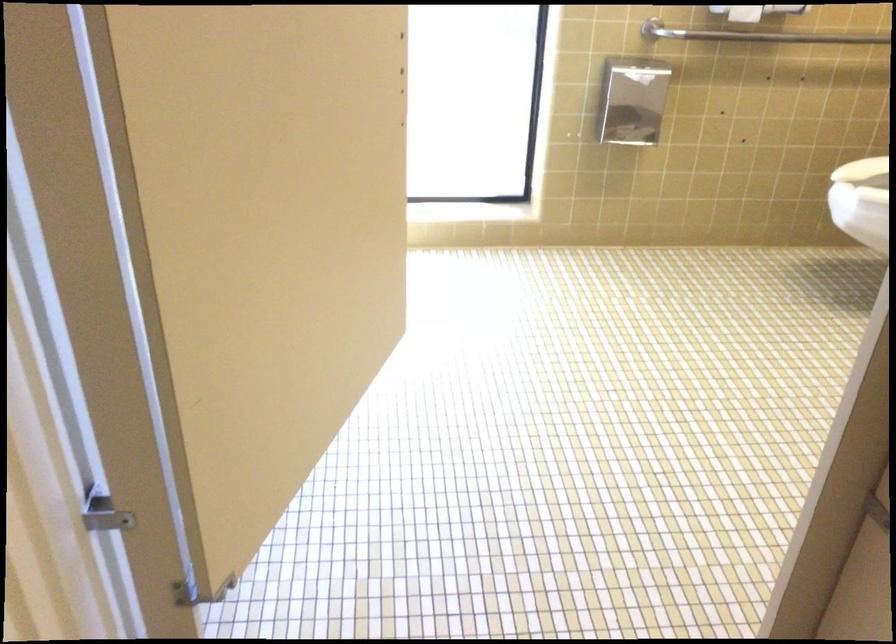
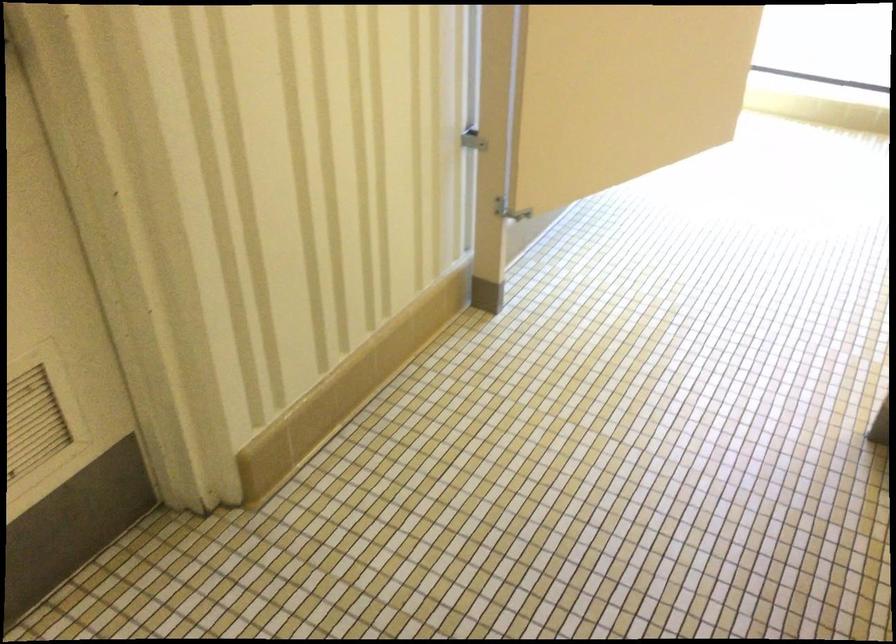
Question: The images are taken continuously from a first-person perspective. In which direction is your viewpoint rotating?

Choices:
 (A) Left
 (B) Right
 (C) Up
 (D) Down

Answer: (A)